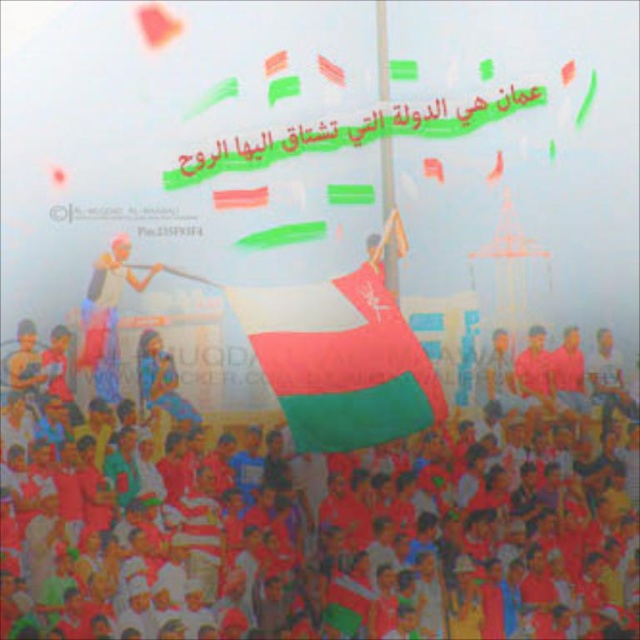
Does point (182, 538) lie in front of point (346, 410)?

Yes, point (182, 538) is in front of point (346, 410).

Can you confirm if red fabric crowd at center is taller than white fabric flag at center?

Yes.

Who is more distant from viewer, (547, 536) or (337, 296)?

The point (337, 296) is behind.

In order to click on red fabric crowd at center in this screenshot , I will do `click(320, 529)`.

Who is more distant from viewer, (x=298, y=435) or (x=84, y=332)?

The point (x=298, y=435) is behind.

Does white fabric flag at center appear over beige fabric cloth at left?

Incorrect, white fabric flag at center is not positioned above beige fabric cloth at left.

Who is more forward, (x=316, y=410) or (x=84, y=301)?

Point (x=84, y=301)

Locate an element on the screen. The width and height of the screenshot is (640, 640). white fabric flag at center is located at coordinates (340, 362).

Does red fabric crowd at center lie in front of beige fabric cloth at left?

Yes.

Identify the location of red fabric crowd at center. This screenshot has height=640, width=640. 320,529.

At what (x,y) coordinates should I click in order to perform the action: click on red fabric crowd at center. Please return your answer as a coordinate pair (x, y). This screenshot has width=640, height=640. Looking at the image, I should click on (320, 529).

Locate an element on the screen. This screenshot has height=640, width=640. red fabric crowd at center is located at coordinates (320, 529).